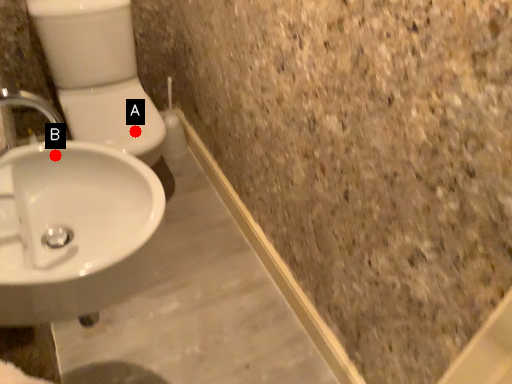
Question: Two points are circled on the image, labeled by A and B beside each circle. Which point is closer to the camera?

Choices:
 (A) A is closer
 (B) B is closer

Answer: (B)